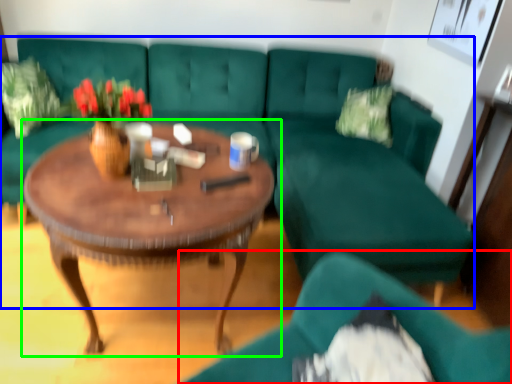
Question: Estimate the real-world distances between objects in this image. Which object is closer to chair (highlighted by a red box), studio couch (highlighted by a blue box) or coffee table (highlighted by a green box)?

Choices:
 (A) studio couch
 (B) coffee table

Answer: (B)